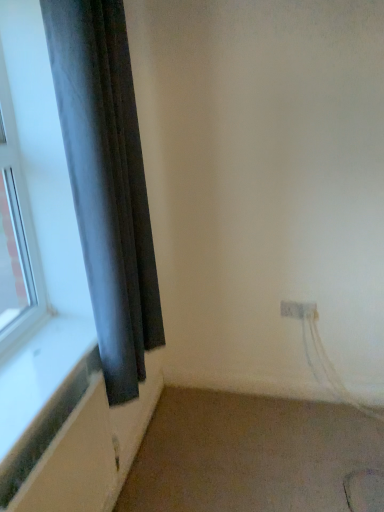
Question: From the image's perspective, is beige carpet at lower right under dark gray fabric curtain at left?

Choices:
 (A) yes
 (B) no

Answer: (A)

Question: Can you confirm if beige carpet at lower right is shorter than dark gray fabric curtain at left?

Choices:
 (A) yes
 (B) no

Answer: (A)

Question: Is beige carpet at lower right outside of dark gray fabric curtain at left?

Choices:
 (A) yes
 (B) no

Answer: (A)

Question: Can you confirm if beige carpet at lower right is wider than dark gray fabric curtain at left?

Choices:
 (A) no
 (B) yes

Answer: (B)

Question: From the image's perspective, is beige carpet at lower right on top of dark gray fabric curtain at left?

Choices:
 (A) no
 (B) yes

Answer: (A)

Question: Considering the positions of white plastic electric outlet at lower right and dark gray fabric curtain at left in the image, is white plastic electric outlet at lower right taller or shorter than dark gray fabric curtain at left?

Choices:
 (A) short
 (B) tall

Answer: (A)

Question: Is white plastic electric outlet at lower right spatially inside dark gray fabric curtain at left, or outside of it?

Choices:
 (A) inside
 (B) outside

Answer: (B)

Question: From a real-world perspective, is white plastic electric outlet at lower right above or below dark gray fabric curtain at left?

Choices:
 (A) above
 (B) below

Answer: (B)

Question: From the image's perspective, is white plastic electric outlet at lower right located above or below dark gray fabric curtain at left?

Choices:
 (A) below
 (B) above

Answer: (A)

Question: From the image's perspective, is beige carpet at lower right above or below dark gray fabric curtain at left?

Choices:
 (A) above
 (B) below

Answer: (B)

Question: In terms of width, does beige carpet at lower right look wider or thinner when compared to dark gray fabric curtain at left?

Choices:
 (A) wide
 (B) thin

Answer: (A)

Question: From a real-world perspective, is beige carpet at lower right positioned above or below dark gray fabric curtain at left?

Choices:
 (A) above
 (B) below

Answer: (B)

Question: Based on their positions, is beige carpet at lower right located to the left or right of dark gray fabric curtain at left?

Choices:
 (A) left
 (B) right

Answer: (B)

Question: In terms of size, does dark gray fabric curtain at left appear bigger or smaller than white plastic electric outlet at lower right?

Choices:
 (A) small
 (B) big

Answer: (B)

Question: In terms of height, does dark gray fabric curtain at left look taller or shorter compared to white plastic electric outlet at lower right?

Choices:
 (A) short
 (B) tall

Answer: (B)